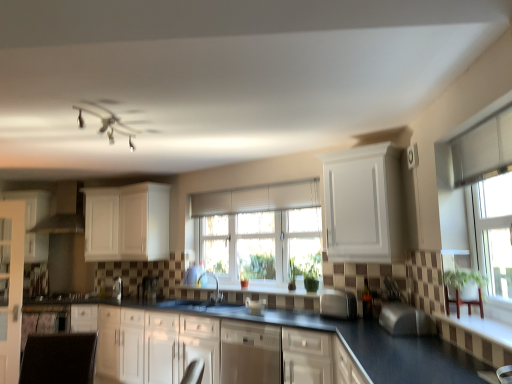
Question: Does white matte cabinet at upper left, arranged as the 2th cabinetry when viewed from the left, turn towards satin black coffee machine at center?

Choices:
 (A) yes
 (B) no

Answer: (B)

Question: From the image's perspective, is white matte cabinet at upper left, marked as the 4th cabinetry in a right-to-left arrangement, on top of satin black coffee machine at center?

Choices:
 (A) yes
 (B) no

Answer: (A)

Question: Is white matte cabinet at upper left, marked as the 4th cabinetry in a right-to-left arrangement, outside satin black coffee machine at center?

Choices:
 (A) no
 (B) yes

Answer: (B)

Question: Is white matte cabinet at upper left, arranged as the 2th cabinetry when viewed from the left, smaller than satin black coffee machine at center?

Choices:
 (A) no
 (B) yes

Answer: (A)

Question: Does white matte cabinet at upper left, marked as the 4th cabinetry in a right-to-left arrangement, lie in front of satin black coffee machine at center?

Choices:
 (A) yes
 (B) no

Answer: (B)

Question: Is white matte cabinet at upper left, arranged as the 2th cabinetry when viewed from the left, inside or outside of white pleated blinds at center?

Choices:
 (A) outside
 (B) inside

Answer: (A)

Question: From the image's perspective, is white matte cabinet at upper left, arranged as the 2th cabinetry when viewed from the left, located above or below white pleated blinds at center?

Choices:
 (A) above
 (B) below

Answer: (B)

Question: Considering the positions of white matte cabinet at upper left, marked as the 4th cabinetry in a right-to-left arrangement, and white pleated blinds at center in the image, is white matte cabinet at upper left, marked as the 4th cabinetry in a right-to-left arrangement, taller or shorter than white pleated blinds at center?

Choices:
 (A) short
 (B) tall

Answer: (B)

Question: In terms of size, does white matte cabinet at upper left, marked as the 4th cabinetry in a right-to-left arrangement, appear bigger or smaller than white pleated blinds at center?

Choices:
 (A) big
 (B) small

Answer: (A)

Question: From a real-world perspective, is white glossy cabinet at left, the 1th cabinetry in the left-to-right sequence, physically located above or below satin nickel faucet at center?

Choices:
 (A) below
 (B) above

Answer: (B)

Question: Based on their sizes in the image, would you say white glossy cabinet at left, the 1th cabinetry in the left-to-right sequence, is bigger or smaller than satin nickel faucet at center?

Choices:
 (A) small
 (B) big

Answer: (B)

Question: Do you think white glossy cabinet at left, the 1th cabinetry in the left-to-right sequence, is within satin nickel faucet at center, or outside of it?

Choices:
 (A) outside
 (B) inside

Answer: (A)

Question: Does point (28, 213) appear closer or farther from the camera than point (218, 301)?

Choices:
 (A) closer
 (B) farther

Answer: (B)

Question: Is silver metallic toaster at center, which appears as the 2th appliance when viewed from the left, to the left or to the right of matte white exhaust hood at left in the image?

Choices:
 (A) right
 (B) left

Answer: (A)

Question: Which is correct: silver metallic toaster at center, placed as the 2th appliance when sorted from bottom to top, is inside matte white exhaust hood at left, or outside of it?

Choices:
 (A) inside
 (B) outside

Answer: (B)